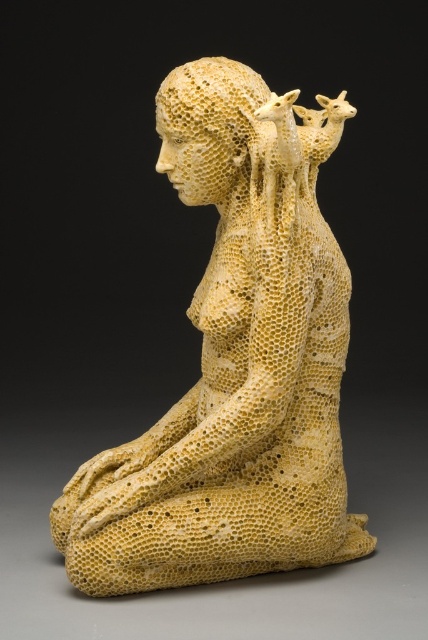
Question: Which object appears farthest from the camera in this image?

Choices:
 (A) yellow honeycomb sculpture at center
 (B) honeycomb-patterned head at center

Answer: (B)

Question: Which object is farther from the camera taking this photo?

Choices:
 (A) yellow honeycomb sculpture at center
 (B) honeycomb-patterned head at center

Answer: (B)

Question: In this image, where is yellow honeycomb sculpture at center located relative to honeycomb-patterned head at center?

Choices:
 (A) below
 (B) above

Answer: (A)

Question: Does yellow honeycomb sculpture at center have a greater width compared to honeycomb-patterned head at center?

Choices:
 (A) no
 (B) yes

Answer: (B)

Question: Is yellow honeycomb sculpture at center closer to camera compared to honeycomb-patterned head at center?

Choices:
 (A) yes
 (B) no

Answer: (A)